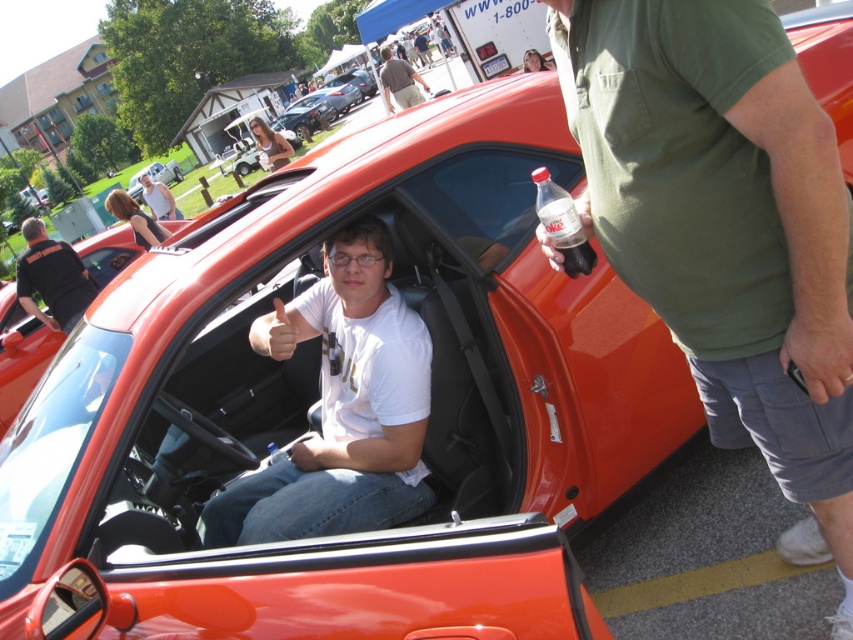
In the scene shown: You are a photographer at the car show and want to take a group photo of the green cotton shirt at right and black cotton shirt at left. The camera you are using has a maximum focus range of 20 feet. Will both subjects be in focus?

The green cotton shirt at right and black cotton shirt at left are 20.61 feet apart from each other. Since the camera has a maximum focus range of 20 feet, the distance between them exceeds this limit, so both subjects may not be in focus simultaneously.

You are a photographer at the car show and want to take a photo of the clear plastic bottle at center and the brown cotton shirt at center. Which object should you focus on first if you want to capture both in the same frame without moving the camera?

The clear plastic bottle at center is not as tall as the brown cotton shirt at center, so you should focus on the brown cotton shirt at center first to ensure it is in focus since it is taller and might require more attention in the frame.